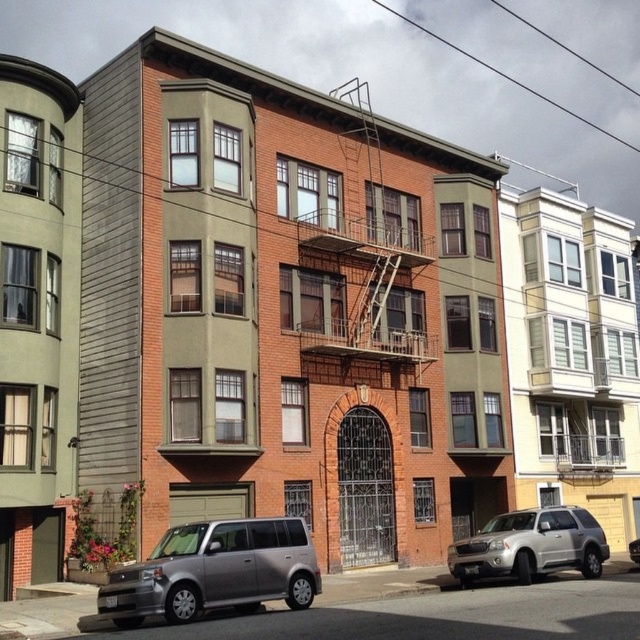
Question: Is brick fire escape at center positioned behind silver metallic suv at center?

Choices:
 (A) yes
 (B) no

Answer: (A)

Question: Estimate the real-world distances between objects in this image. Which object is farther from the satin silver minivan at lower left?

Choices:
 (A) brick fire escape at center
 (B) silver metallic suv at center

Answer: (A)

Question: Which of the following is the farthest from the observer?

Choices:
 (A) satin silver minivan at lower left
 (B) silver metallic suv at center
 (C) brick fire escape at center

Answer: (C)

Question: Can you confirm if brick fire escape at center is wider than silver metallic suv at center?

Choices:
 (A) no
 (B) yes

Answer: (B)

Question: Which of the following is the farthest from the observer?

Choices:
 (A) (378, 214)
 (B) (284, 556)
 (C) (564, 513)

Answer: (A)

Question: Can you confirm if satin silver minivan at lower left is positioned below brick fire escape at center?

Choices:
 (A) no
 (B) yes

Answer: (B)